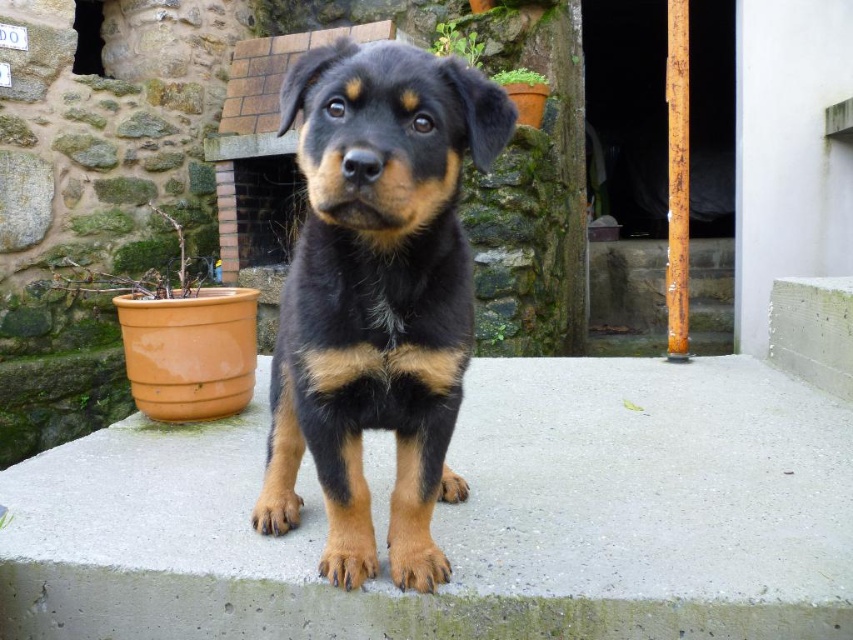
Question: Does smooth concrete at center have a lesser width compared to black fur puppy at center?

Choices:
 (A) yes
 (B) no

Answer: (B)

Question: Which object is farther from the camera taking this photo?

Choices:
 (A) smooth concrete stairs at center
 (B) black fur puppy at center

Answer: (A)

Question: Considering the relative positions of black fur puppy at center and smooth concrete stairs at center in the image provided, where is black fur puppy at center located with respect to smooth concrete stairs at center?

Choices:
 (A) below
 (B) above

Answer: (A)

Question: Which of the following is the farthest from the observer?

Choices:
 (A) smooth concrete at center
 (B) black fur puppy at center
 (C) smooth concrete stairs at center

Answer: (C)

Question: Is black fur puppy at center further to the viewer compared to smooth concrete stairs at center?

Choices:
 (A) yes
 (B) no

Answer: (B)

Question: Which of the following is the farthest from the observer?

Choices:
 (A) smooth concrete at center
 (B) black fur puppy at center
 (C) smooth concrete stairs at center

Answer: (C)